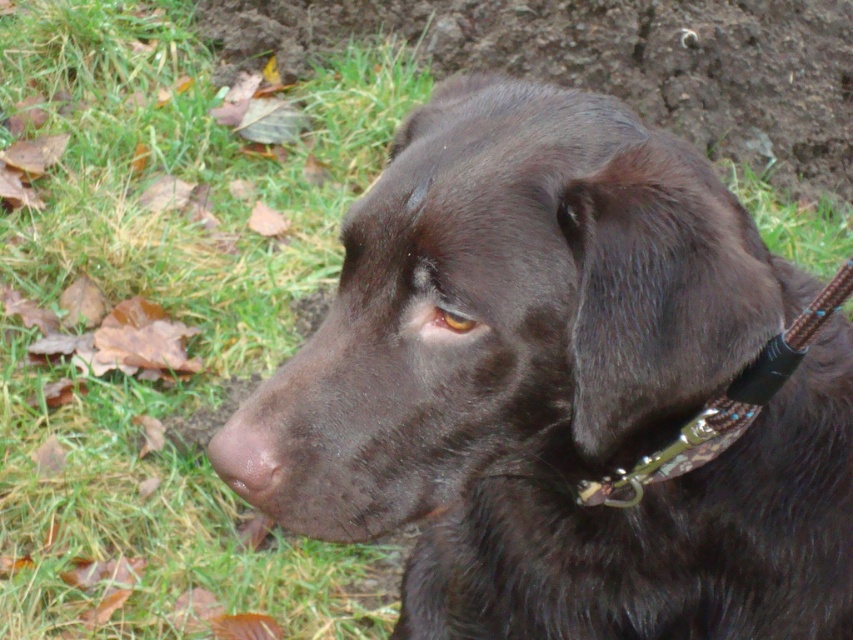
Describe the element at coordinates (164, 323) in the screenshot. I see `green grass at lower left` at that location.

Who is positioned more to the left, green grass at lower left or brown smooth nose at center?

From the viewer's perspective, green grass at lower left appears more on the left side.

What do you see at coordinates (164, 323) in the screenshot? The width and height of the screenshot is (853, 640). I see `green grass at lower left` at bounding box center [164, 323].

This screenshot has height=640, width=853. In order to click on green grass at lower left in this screenshot , I will do `click(164, 323)`.

What do you see at coordinates (564, 385) in the screenshot?
I see `shiny black dog at center` at bounding box center [564, 385].

Measure the distance between shiny black dog at center and camera.

shiny black dog at center is 33.27 inches from camera.

Does point (368, 481) lie in front of point (253, 576)?

Yes, it is.

The width and height of the screenshot is (853, 640). Identify the location of shiny black dog at center. (564, 385).

Is shiny black dog at center bigger than brown smooth nose at center?

Indeed, shiny black dog at center has a larger size compared to brown smooth nose at center.

This screenshot has width=853, height=640. What do you see at coordinates (564, 385) in the screenshot?
I see `shiny black dog at center` at bounding box center [564, 385].

Between point (769, 460) and point (254, 424), which one is positioned behind?

Positioned behind is point (769, 460).

Locate an element on the screen. Image resolution: width=853 pixels, height=640 pixels. shiny black dog at center is located at coordinates (564, 385).